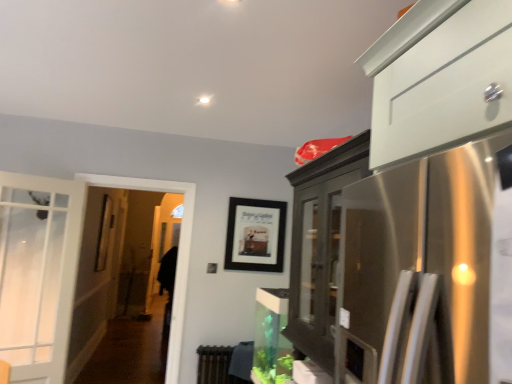
Question: Considering the relative positions of black matte picture frame at center and brown textured radiator at lower center in the image provided, is black matte picture frame at center behind brown textured radiator at lower center?

Choices:
 (A) yes
 (B) no

Answer: (A)

Question: Is black matte picture frame at center wider than brown textured radiator at lower center?

Choices:
 (A) no
 (B) yes

Answer: (A)

Question: Is black matte picture frame at center not close to brown textured radiator at lower center?

Choices:
 (A) yes
 (B) no

Answer: (B)

Question: Is black matte picture frame at center oriented away from brown textured radiator at lower center?

Choices:
 (A) yes
 (B) no

Answer: (B)

Question: From a real-world perspective, is black matte picture frame at center below brown textured radiator at lower center?

Choices:
 (A) no
 (B) yes

Answer: (A)

Question: From a real-world perspective, relative to brown textured radiator at lower center, is clear glass screen door at left vertically above or below?

Choices:
 (A) below
 (B) above

Answer: (B)

Question: Would you say clear glass screen door at left is inside or outside brown textured radiator at lower center?

Choices:
 (A) inside
 (B) outside

Answer: (B)

Question: Is clear glass screen door at left in front of or behind brown textured radiator at lower center in the image?

Choices:
 (A) behind
 (B) front

Answer: (B)

Question: In the image, is clear glass screen door at left on the left side or the right side of brown textured radiator at lower center?

Choices:
 (A) left
 (B) right

Answer: (A)

Question: From their relative heights in the image, would you say black matte picture frame at center is taller or shorter than clear glass screen door at left?

Choices:
 (A) short
 (B) tall

Answer: (A)

Question: Is black matte picture frame at center to the left or to the right of clear glass screen door at left in the image?

Choices:
 (A) right
 (B) left

Answer: (A)

Question: From a real-world perspective, relative to clear glass screen door at left, is black matte picture frame at center vertically above or below?

Choices:
 (A) below
 (B) above

Answer: (B)

Question: Is black matte picture frame at center inside the boundaries of clear glass screen door at left, or outside?

Choices:
 (A) inside
 (B) outside

Answer: (B)

Question: Looking at their shapes, would you say clear glass screen door at left is wider or thinner than black matte picture frame at center?

Choices:
 (A) wide
 (B) thin

Answer: (A)

Question: From the image's perspective, relative to black matte picture frame at center, is clear glass screen door at left above or below?

Choices:
 (A) below
 (B) above

Answer: (A)